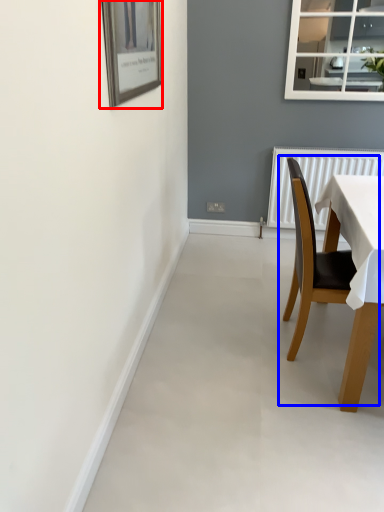
Question: Which of the following is the farthest to the observer, picture frame (highlighted by a red box) or chair (highlighted by a blue box)?

Choices:
 (A) picture frame
 (B) chair

Answer: (B)